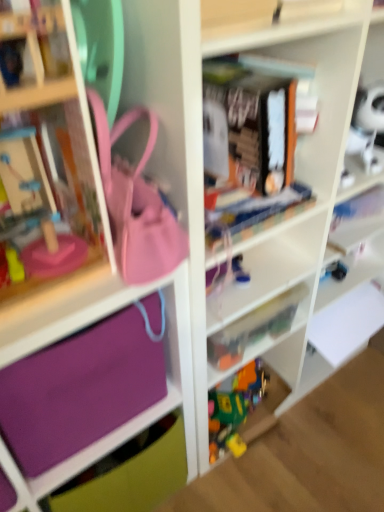
The height and width of the screenshot is (512, 384). Find the location of `purple fabric bag at left, which appears as the first cabinet when viewed from the right`. purple fabric bag at left, which appears as the first cabinet when viewed from the right is located at coordinates (299, 179).

What do you see at coordinates (140, 413) in the screenshot?
I see `purple fabric at lower left, placed as the first cabinet when sorted from left to right` at bounding box center [140, 413].

Find the location of a particular element. Image resolution: width=384 pixels, height=512 pixels. translucent plastic toys at center is located at coordinates (255, 330).

Is blue rubber toy at center not close to matte pink purse at center?

That's not correct — blue rubber toy at center is a little close to matte pink purse at center.

Is point (206, 277) positioned after point (126, 232)?

Yes, it is.

Is blue rubber toy at center facing towards matte pink purse at center?

No, blue rubber toy at center is not oriented towards matte pink purse at center.

How many degrees apart are the facing directions of blue rubber toy at center and matte pink purse at center?

The facing directions of blue rubber toy at center and matte pink purse at center are 17.5 degrees apart.

Is matte pink purse at center far from purple fabric bag at left, which appears as the first cabinet when viewed from the right?

No, matte pink purse at center is in close proximity to purple fabric bag at left, which appears as the first cabinet when viewed from the right.

Which of these two, matte pink purse at center or purple fabric bag at left, which is the 2th cabinet from left to right, stands shorter?

matte pink purse at center.

Where is `accessory above the purple fabric bag at left, which is the 2th cabinet from left to right (from a real-world perspective)`? The height and width of the screenshot is (512, 384). accessory above the purple fabric bag at left, which is the 2th cabinet from left to right (from a real-world perspective) is located at coordinates (136, 204).

Find the location of a particular element. The width and height of the screenshot is (384, 512). accessory that appears on the left of purple fabric bag at left, which appears as the first cabinet when viewed from the right is located at coordinates (136, 204).

Does purple fabric bag at left, which is the 2th cabinet from left to right, turn towards matte pink purse at center?

No.

Considering the relative sizes of purple fabric bag at left, which is the 2th cabinet from left to right, and matte pink purse at center in the image provided, is purple fabric bag at left, which is the 2th cabinet from left to right, smaller than matte pink purse at center?

Actually, purple fabric bag at left, which is the 2th cabinet from left to right, might be larger than matte pink purse at center.

Starting from the blue rubber toy at center, which cabinet is the 1st one in front? Please provide its 2D coordinates.

[(140, 413)]

Does purple fabric at lower left, placed as the first cabinet when sorted from left to right, contain blue rubber toy at center?

No, blue rubber toy at center is not surrounded by purple fabric at lower left, placed as the first cabinet when sorted from left to right.

Could you measure the distance between purple fabric at lower left, which appears as the second cabinet when viewed from the right, and blue rubber toy at center?

purple fabric at lower left, which appears as the second cabinet when viewed from the right, and blue rubber toy at center are 10.05 inches apart.

Is purple fabric at lower left, which appears as the second cabinet when viewed from the right, aimed at blue rubber toy at center?

No, purple fabric at lower left, which appears as the second cabinet when viewed from the right, is not turned towards blue rubber toy at center.

Considering the positions of objects blue rubber toy at center and translucent plastic toys at center in the image provided, who is more to the left, blue rubber toy at center or translucent plastic toys at center?

blue rubber toy at center is more to the left.

Is blue rubber toy at center positioned beyond the bounds of translucent plastic toys at center?

blue rubber toy at center is positioned outside translucent plastic toys at center.

Does blue rubber toy at center have a lesser width compared to translucent plastic toys at center?

In fact, blue rubber toy at center might be wider than translucent plastic toys at center.

Between blue rubber toy at center and translucent plastic toys at center, which one has less height?

blue rubber toy at center.

Does purple fabric bag at left, which is the 2th cabinet from left to right, turn towards translucent plastic toys at center?

Yes, purple fabric bag at left, which is the 2th cabinet from left to right, is aimed at translucent plastic toys at center.

From the image's perspective, would you say purple fabric bag at left, which is the 2th cabinet from left to right, is positioned over translucent plastic toys at center?

Correct, purple fabric bag at left, which is the 2th cabinet from left to right, appears higher than translucent plastic toys at center in the image.

Considering the sizes of objects purple fabric bag at left, which appears as the first cabinet when viewed from the right, and translucent plastic toys at center in the image provided, who is bigger, purple fabric bag at left, which appears as the first cabinet when viewed from the right, or translucent plastic toys at center?

With larger size is purple fabric bag at left, which appears as the first cabinet when viewed from the right.

The width and height of the screenshot is (384, 512). In order to click on the 2nd cabinet in front of the translucent plastic toys at center in this screenshot , I will do `click(299, 179)`.

Is purple fabric bag at left, which appears as the first cabinet when viewed from the right, directly adjacent to blue rubber toy at center?

No.

The height and width of the screenshot is (512, 384). Identify the location of toy located behind the purple fabric bag at left, which is the 2th cabinet from left to right. [x=227, y=273].

Which of these two, purple fabric bag at left, which is the 2th cabinet from left to right, or blue rubber toy at center, is smaller?

blue rubber toy at center is smaller.

Find the location of a particular element. The height and width of the screenshot is (512, 384). accessory on the left of the blue rubber toy at center is located at coordinates (136, 204).

Where is `accessory lying above the purple fabric bag at left, which is the 2th cabinet from left to right (from the image's perspective)`? The width and height of the screenshot is (384, 512). accessory lying above the purple fabric bag at left, which is the 2th cabinet from left to right (from the image's perspective) is located at coordinates (136, 204).

Which object lies nearer to the anchor point matte pink purse at center, purple fabric at lower left, which appears as the second cabinet when viewed from the right, or blue rubber toy at center?

Based on the image, purple fabric at lower left, which appears as the second cabinet when viewed from the right, appears to be nearer to matte pink purse at center.

When comparing their distances from blue rubber toy at center, does matte pink purse at center or translucent plastic toys at center seem further?

matte pink purse at center lies further to blue rubber toy at center than the other object.

Based on the photo, based on their spatial positions, is matte pink purse at center or blue rubber toy at center further from purple fabric at lower left, which appears as the second cabinet when viewed from the right?

Based on the image, blue rubber toy at center appears to be further to purple fabric at lower left, which appears as the second cabinet when viewed from the right.

Which object lies further to the anchor point translucent plastic toys at center, matte pink purse at center or purple fabric bag at left, which is the 2th cabinet from left to right?

matte pink purse at center lies further to translucent plastic toys at center than the other object.

Estimate the real-world distances between objects in this image. Which object is further from blue rubber toy at center, purple fabric bag at left, which appears as the first cabinet when viewed from the right, or translucent plastic toys at center?

purple fabric bag at left, which appears as the first cabinet when viewed from the right, lies further to blue rubber toy at center than the other object.

Looking at the image, which one is located closer to blue rubber toy at center, matte pink purse at center or purple fabric at lower left, placed as the first cabinet when sorted from left to right?

Among the two, matte pink purse at center is located nearer to blue rubber toy at center.

Estimate the real-world distances between objects in this image. Which object is closer to blue rubber toy at center, translucent plastic toys at center or purple fabric at lower left, which appears as the second cabinet when viewed from the right?

translucent plastic toys at center lies closer to blue rubber toy at center than the other object.

Based on their spatial positions, is matte pink purse at center or purple fabric at lower left, placed as the first cabinet when sorted from left to right, closer to translucent plastic toys at center?

purple fabric at lower left, placed as the first cabinet when sorted from left to right.

Where is `cabinet positioned between purple fabric bag at left, which appears as the first cabinet when viewed from the right, and blue rubber toy at center from near to far`? The image size is (384, 512). cabinet positioned between purple fabric bag at left, which appears as the first cabinet when viewed from the right, and blue rubber toy at center from near to far is located at coordinates (140, 413).

Identify the location of shelf between purple fabric bag at left, which appears as the first cabinet when viewed from the right, and blue rubber toy at center from front to back. (255, 330).

Where is `shelf between matte pink purse at center and blue rubber toy at center in the front-back direction`? The width and height of the screenshot is (384, 512). shelf between matte pink purse at center and blue rubber toy at center in the front-back direction is located at coordinates (255, 330).

You are a GUI agent. You are given a task and a screenshot of the screen. Output one action in this format:
    pyautogui.click(x=<x>, y=<y>)
    Task: Click on the toy between purple fabric at lower left, placed as the first cabinet when sorted from left to right, and translucent plastic toys at center from left to right
    The image size is (384, 512).
    Given the screenshot: What is the action you would take?
    pyautogui.click(x=227, y=273)